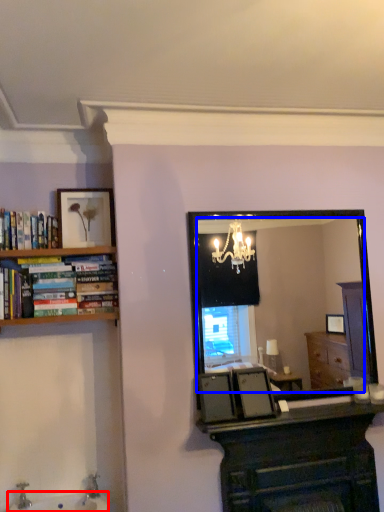
Question: Among these objects, which one is farthest to the camera, sink (highlighted by a red box) or mirror (highlighted by a blue box)?

Choices:
 (A) sink
 (B) mirror

Answer: (B)